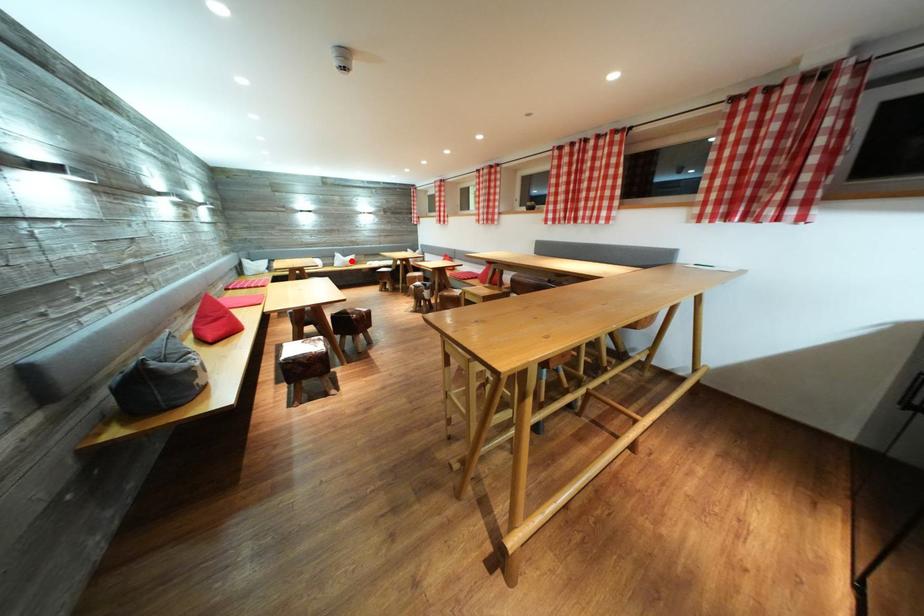
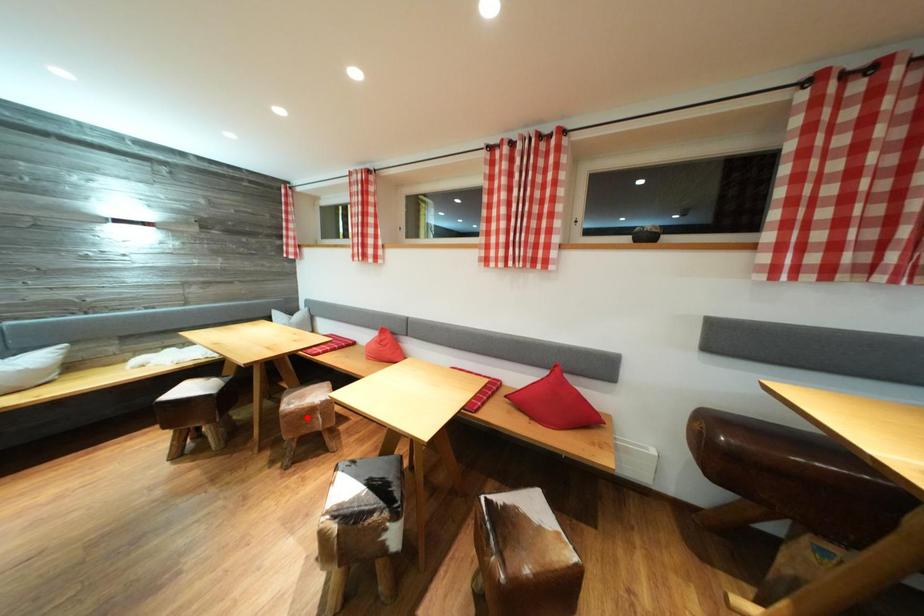
I am providing you with two images of the same scene from different viewpoints. A red point is marked on the first image and another point is marked on the second image. Do the highlighted points in image1 and image2 indicate the same real-world spot?

No